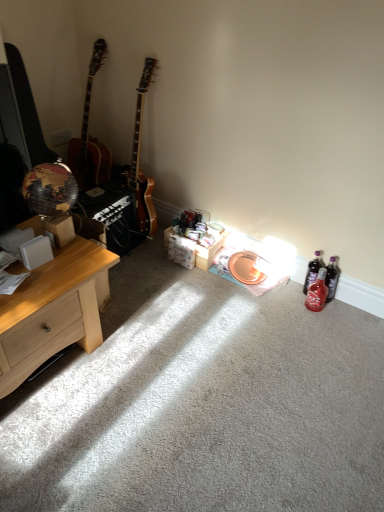
Question: Are translucent red glass bottle at lower right, acting as the 2th bottle starting from the back, and translucent purple bottle at lower right, which appears as the first bottle when viewed from the back, located far from each other?

Choices:
 (A) no
 (B) yes

Answer: (A)

Question: Is translucent red glass bottle at lower right, the first bottle viewed from the front, behind translucent purple bottle at lower right, which is the 2th bottle in front-to-back order?

Choices:
 (A) yes
 (B) no

Answer: (B)

Question: From a real-world perspective, is translucent red glass bottle at lower right, acting as the 2th bottle starting from the back, physically above translucent purple bottle at lower right, which is the 2th bottle in front-to-back order?

Choices:
 (A) no
 (B) yes

Answer: (A)

Question: From a real-world perspective, is translucent red glass bottle at lower right, acting as the 2th bottle starting from the back, below translucent purple bottle at lower right, which appears as the first bottle when viewed from the back?

Choices:
 (A) yes
 (B) no

Answer: (A)

Question: Can you confirm if translucent red glass bottle at lower right, acting as the 2th bottle starting from the back, is thinner than translucent purple bottle at lower right, which is the 2th bottle in front-to-back order?

Choices:
 (A) no
 (B) yes

Answer: (A)

Question: Is point (314, 253) closer or farther from the camera than point (105, 266)?

Choices:
 (A) farther
 (B) closer

Answer: (A)

Question: Is translucent purple bottle at lower right, which appears as the first bottle when viewed from the back, in front of or behind light wood desk at left in the image?

Choices:
 (A) front
 (B) behind

Answer: (B)

Question: From a real-world perspective, is translucent purple bottle at lower right, which is the 2th bottle in front-to-back order, physically located above or below light wood desk at left?

Choices:
 (A) above
 (B) below

Answer: (B)

Question: In terms of width, does translucent purple bottle at lower right, which is the 2th bottle in front-to-back order, look wider or thinner when compared to light wood desk at left?

Choices:
 (A) thin
 (B) wide

Answer: (A)

Question: Is translucent purple bottle at lower right, which appears as the first bottle when viewed from the back, situated inside translucent red glass bottle at lower right, the first bottle viewed from the front, or outside?

Choices:
 (A) outside
 (B) inside

Answer: (A)

Question: Considering their positions, is translucent purple bottle at lower right, which is the 2th bottle in front-to-back order, located in front of or behind translucent red glass bottle at lower right, the first bottle viewed from the front?

Choices:
 (A) front
 (B) behind

Answer: (B)

Question: Is translucent purple bottle at lower right, which appears as the first bottle when viewed from the back, to the left or to the right of translucent red glass bottle at lower right, the first bottle viewed from the front, in the image?

Choices:
 (A) left
 (B) right

Answer: (A)

Question: From the image's perspective, is translucent purple bottle at lower right, which appears as the first bottle when viewed from the back, located above or below translucent red glass bottle at lower right, the first bottle viewed from the front?

Choices:
 (A) above
 (B) below

Answer: (A)

Question: From the image's perspective, is translucent red glass bottle at lower right, acting as the 2th bottle starting from the back, positioned above or below translucent purple bottle at lower right, which appears as the first bottle when viewed from the back?

Choices:
 (A) above
 (B) below

Answer: (B)

Question: From a real-world perspective, is translucent red glass bottle at lower right, the first bottle viewed from the front, positioned above or below translucent purple bottle at lower right, which is the 2th bottle in front-to-back order?

Choices:
 (A) above
 (B) below

Answer: (B)